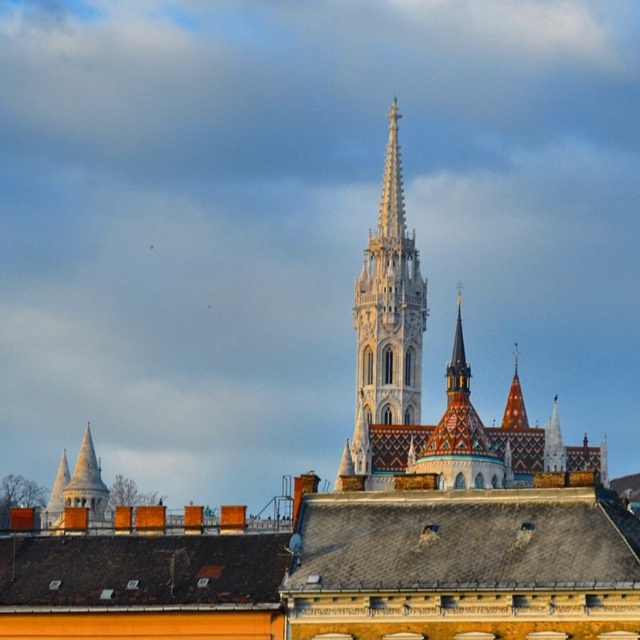
Question: Which of the following is the closest to the observer?

Choices:
 (A) (72, 490)
 (B) (390, 272)

Answer: (A)

Question: Which point is closer to the camera taking this photo?

Choices:
 (A) (93, 454)
 (B) (387, 179)

Answer: (A)

Question: Does white stone spire at center have a greater width compared to white stone tower at lower left?

Choices:
 (A) no
 (B) yes

Answer: (A)

Question: Can you confirm if white stone spire at center is wider than white stone tower at lower left?

Choices:
 (A) yes
 (B) no

Answer: (B)

Question: Is white stone spire at center smaller than white stone tower at lower left?

Choices:
 (A) yes
 (B) no

Answer: (A)